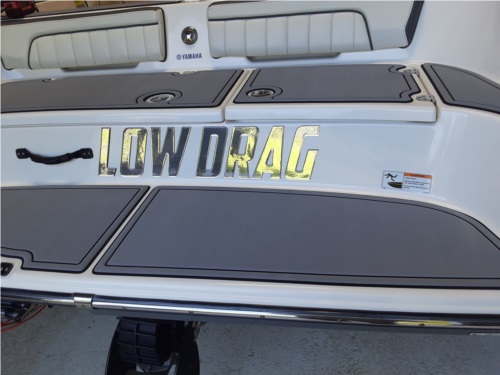
Locate an element on the screen. cables is located at coordinates (7, 321), (12, 322), (18, 325).